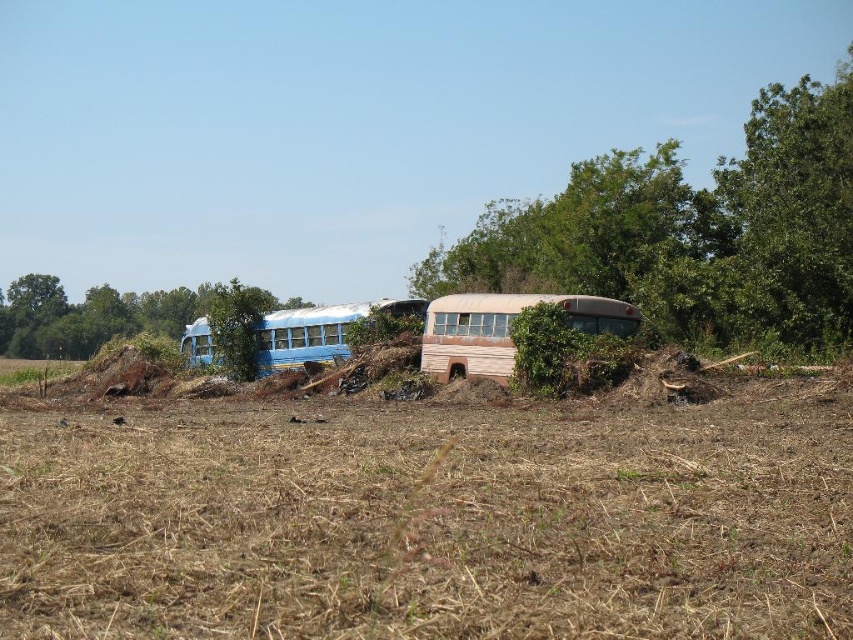
Which is in front, point (657, 202) or point (544, 294)?

Point (544, 294)

Consider the image. Who is shorter, green leafy tree at upper right or rusty wood school bus at center?

rusty wood school bus at center is shorter.

This screenshot has height=640, width=853. I want to click on green leafy tree at upper right, so click(691, 230).

Who is more distant from viewer, (659,170) or (260,353)?

The point (659,170) is behind.

Which of these two, green leafy tree at upper right or blue matte school bus at center-left, stands taller?

With more height is green leafy tree at upper right.

Does point (558, 237) lie in front of point (421, 298)?

Yes, point (558, 237) is in front of point (421, 298).

The image size is (853, 640). I want to click on green leafy tree at upper right, so click(x=691, y=230).

Is brown dry grass at center taller than green leafy tree at upper right?

Incorrect, brown dry grass at center's height is not larger of green leafy tree at upper right's.

Does brown dry grass at center have a larger size compared to green leafy tree at upper right?

No.

Does point (769, 422) lie in front of point (775, 131)?

Yes, point (769, 422) is in front of point (775, 131).

Where is `brown dry grass at center`? This screenshot has height=640, width=853. brown dry grass at center is located at coordinates (431, 518).